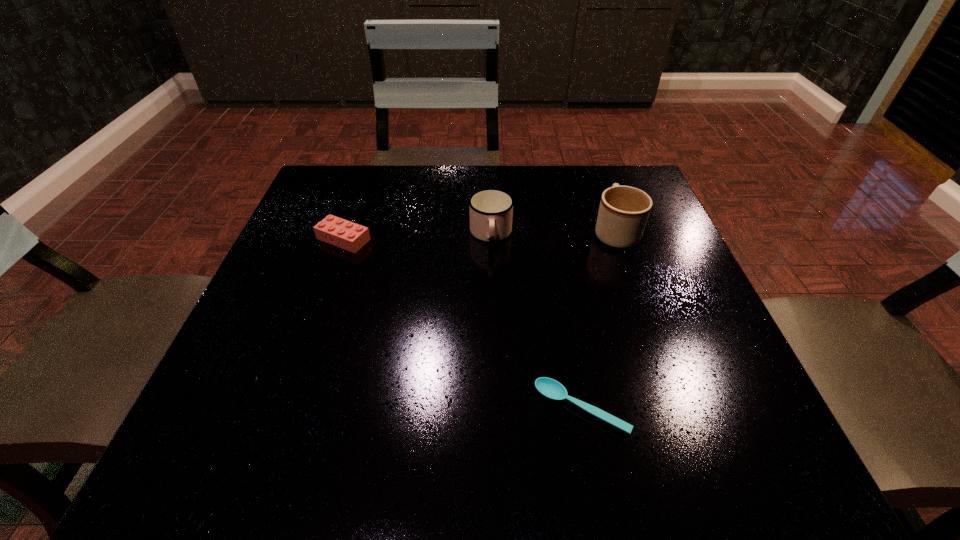
Locate an element on the screen. The height and width of the screenshot is (540, 960). the right mug is located at coordinates (623, 213).

The width and height of the screenshot is (960, 540). I want to click on the tallest object, so click(x=623, y=213).

At what (x,y) coordinates should I click in order to perform the action: click on the third object from right to left. Please return your answer as a coordinate pair (x, y). This screenshot has height=540, width=960. Looking at the image, I should click on (491, 210).

Identify the location of the third shortest object. (491, 210).

Where is `Lego`? Lego is located at coordinates (339, 232).

The image size is (960, 540). Find the location of `the second shortest object`. the second shortest object is located at coordinates (339, 232).

Where is `the nearest object`? The height and width of the screenshot is (540, 960). the nearest object is located at coordinates (550, 388).

At what (x,y) coordinates should I click in order to perform the action: click on spoon. Please return your answer as a coordinate pair (x, y). Image resolution: width=960 pixels, height=540 pixels. Looking at the image, I should click on (550, 388).

I want to click on free location located on the side of the right mug with the handle, so click(x=593, y=170).

In order to click on free space located 0.130m on the side of the right mug with the handle in this screenshot , I will do `click(598, 184)`.